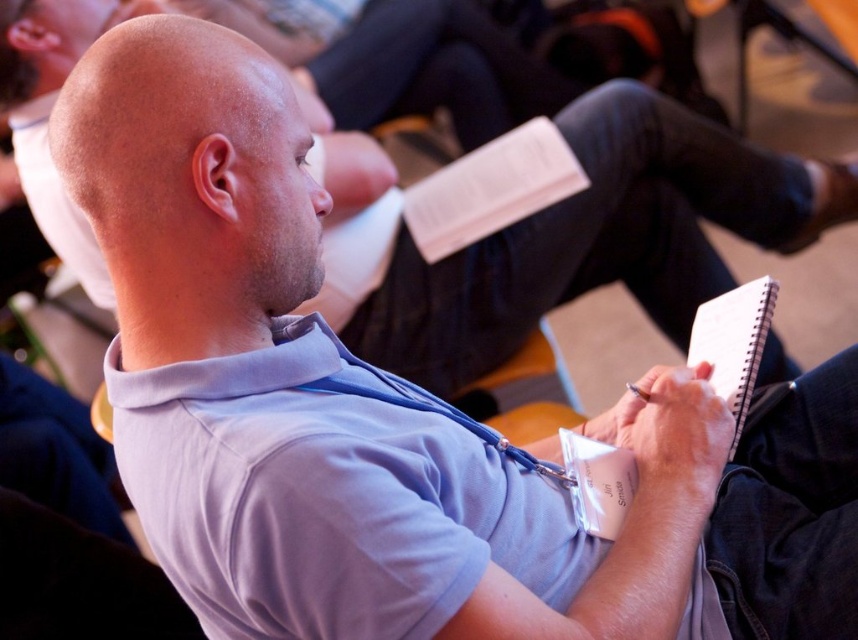
Question: Can you confirm if white spiral notebook at lower right is positioned to the left of white paper notepad at center?

Choices:
 (A) yes
 (B) no

Answer: (B)

Question: Can you confirm if white paper journal at center is wider than white spiral notebook at lower right?

Choices:
 (A) no
 (B) yes

Answer: (B)

Question: Which is nearer to the white paper journal at center?

Choices:
 (A) white spiral notebook at lower right
 (B) white paper notepad at center

Answer: (A)

Question: Which of the following is the farthest from the observer?

Choices:
 (A) (408, 214)
 (B) (614, 499)
 (C) (747, 326)

Answer: (A)

Question: Which of these objects is positioned farthest from the white paper journal at center?

Choices:
 (A) white paper notepad at center
 (B) white spiral notebook at lower right

Answer: (A)

Question: Does white spiral notebook at lower right appear on the right side of white paper notepad at center?

Choices:
 (A) yes
 (B) no

Answer: (A)